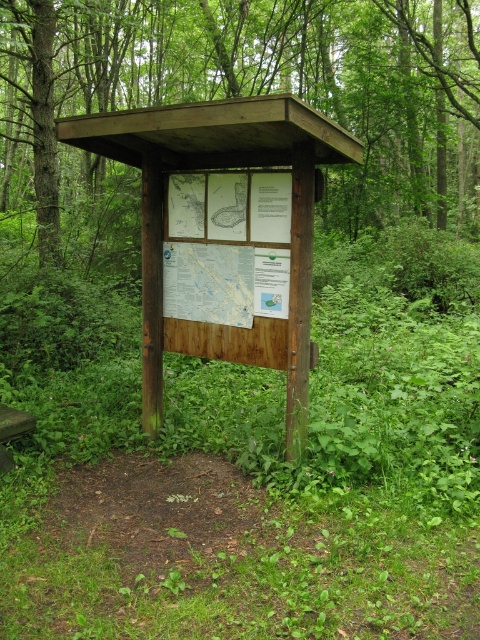
You are standing in front of the wooden information board in the forest. You notice two points labeled as point 1 and point 2 on the board. Point 1 is at coordinate [386,179] and point 2 is at coordinate [163,163]. Which point is closer to you?

Point 1 at coordinate [386,179] is closer to you because it is further to the viewer than point 2 at coordinate [163,163].

You are a park ranger who needs to place a new sign on the wooden information board. The new sign is wider than the brown wood sign at center. Will it fit next to the wooden signboard at center?

The brown wood sign at center is wider than the wooden signboard at center. Since your new sign is wider than the brown wood sign at center, it will not fit next to the wooden signboard at center as it would be too wide.